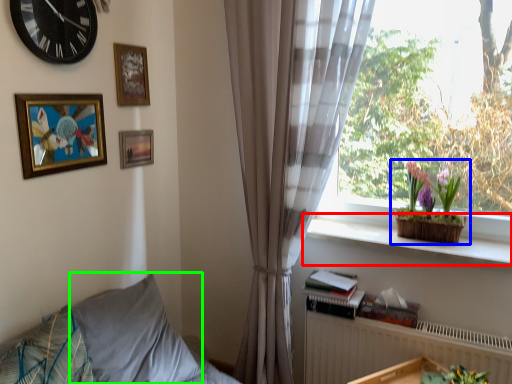
Question: Estimate the real-world distances between objects in this image. Which object is closer to window sill (highlighted by a red box), houseplant (highlighted by a blue box) or pillow (highlighted by a green box)?

Choices:
 (A) houseplant
 (B) pillow

Answer: (A)